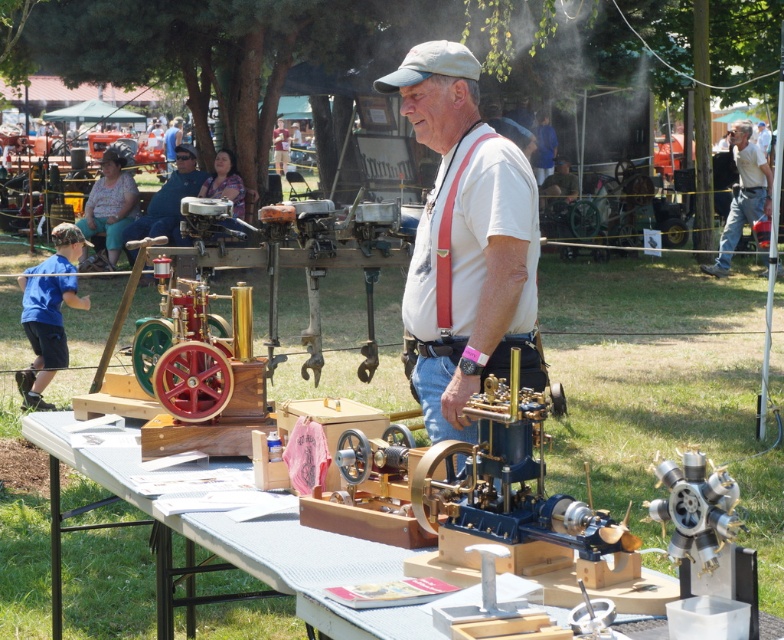
Question: Which point appears farthest from the camera in this image?

Choices:
 (A) (136, 230)
 (B) (445, 273)
 (C) (766, 192)

Answer: (C)

Question: Which of these objects is positioned farthest from the red fabric suspenders at center?

Choices:
 (A) white fabric table at center
 (B) white shirt at upper right
 (C) white cotton shirt at center
 (D) matte black shirt at upper center

Answer: (B)

Question: Can you confirm if white shirt at upper right is thinner than red fabric suspenders at center?

Choices:
 (A) yes
 (B) no

Answer: (B)

Question: Does white shirt at upper right have a greater width compared to matte black shirt at upper center?

Choices:
 (A) no
 (B) yes

Answer: (B)

Question: Which of the following is the closest to the observer?

Choices:
 (A) red fabric suspenders at center
 (B) white shirt at upper right
 (C) matte black shirt at upper center

Answer: (A)

Question: Is white fabric table at center positioned before matte black shirt at upper center?

Choices:
 (A) yes
 (B) no

Answer: (A)